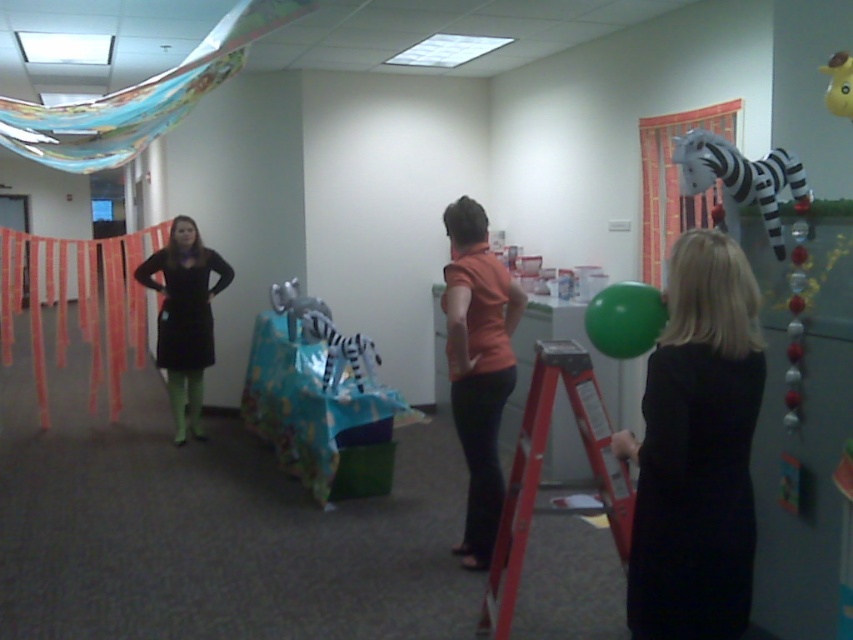
Question: Is orange matte shirt at center below white striped plush zebra at center?

Choices:
 (A) no
 (B) yes

Answer: (B)

Question: Can you confirm if white fabric curtain at upper right is positioned to the right of white striped plush zebra at center?

Choices:
 (A) no
 (B) yes

Answer: (B)

Question: Which object is positioned farthest from the green rubber balloon at right?

Choices:
 (A) white striped plush zebra at center
 (B) black matte dress at right

Answer: (A)

Question: Among these objects, which one is nearest to the camera?

Choices:
 (A) orange matte shirt at center
 (B) white fabric curtain at upper right
 (C) black matte dress at left
 (D) white striped plush zebra at center

Answer: (A)

Question: Does black matte dress at left appear on the left side of yellow rubber duck at upper right?

Choices:
 (A) yes
 (B) no

Answer: (A)

Question: Which is farther from the black matte dress at left?

Choices:
 (A) plush fabric zebra at right
 (B) red metal ladder at lower right
 (C) yellow rubber duck at upper right

Answer: (C)